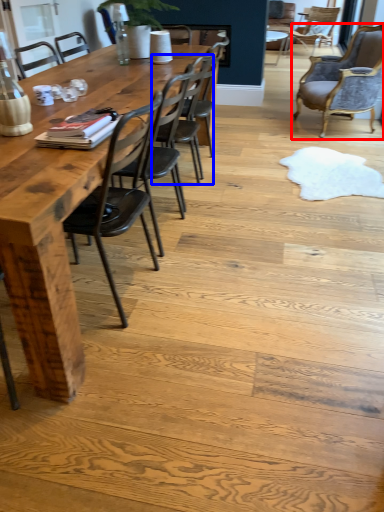
Question: Which point is further to the camera, chair (highlighted by a red box) or chair (highlighted by a blue box)?

Choices:
 (A) chair
 (B) chair

Answer: (A)